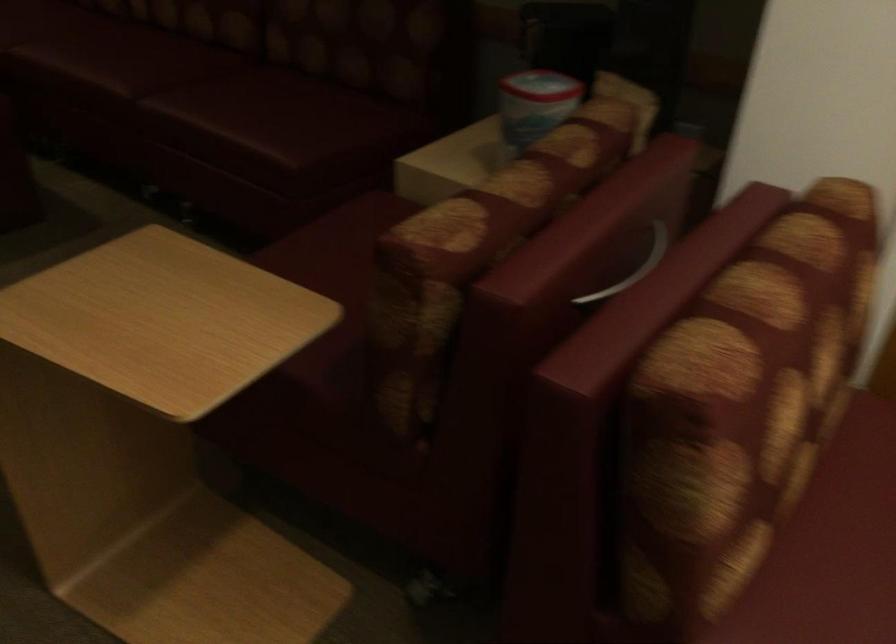
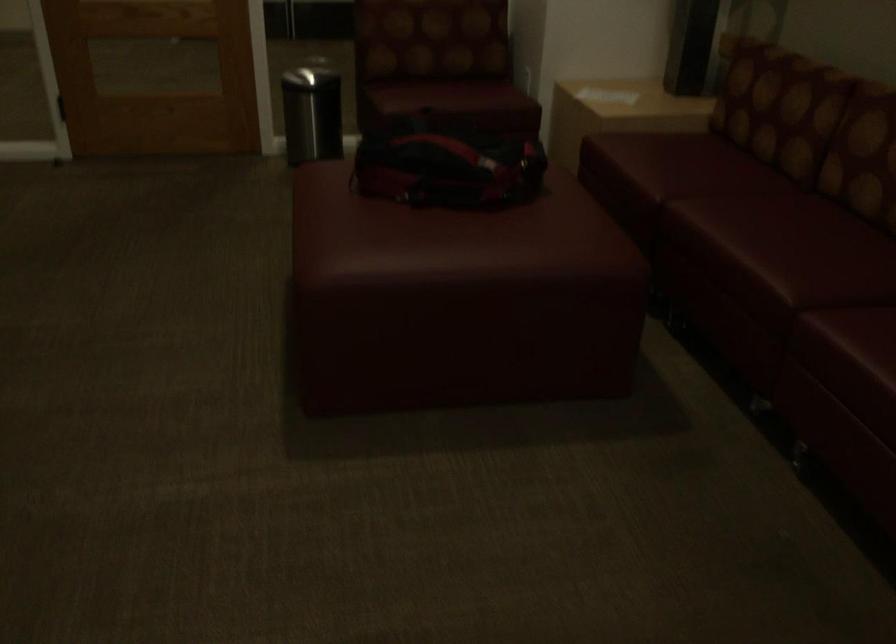
Question: The images are taken continuously from a first-person perspective. In which direction is your viewpoint rotating?

Choices:
 (A) Left
 (B) Right
 (C) Up
 (D) Down

Answer: (A)